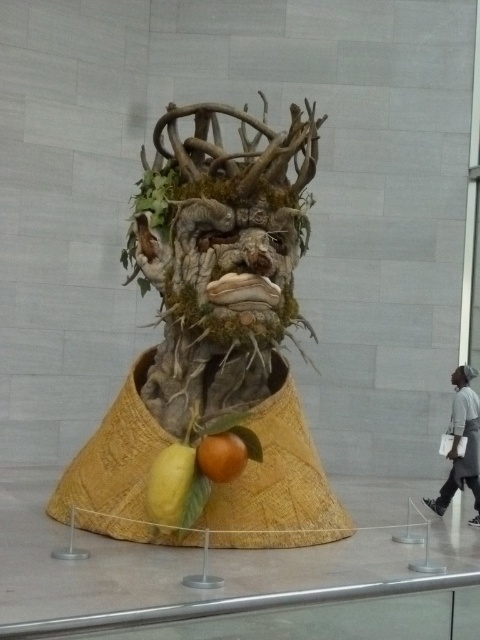
Question: Does mossy bark mask at center appear on the left side of gray fabric jacket at lower right?

Choices:
 (A) yes
 (B) no

Answer: (A)

Question: Is mossy bark mask at center bigger than orange matte at lower center?

Choices:
 (A) no
 (B) yes

Answer: (B)

Question: Which of these objects is positioned closest to the wooden sculpture at center?

Choices:
 (A) gray fabric jacket at lower right
 (B) matte brown mask at center
 (C) orange matte at lower center

Answer: (C)

Question: Which object is the farthest from the mossy bark mask at center?

Choices:
 (A) white matte face at center
 (B) yellow matte pear at lower center
 (C) orange matte at lower center
 (D) wooden sculpture at center

Answer: (A)

Question: Observing the image, what is the correct spatial positioning of wooden sculpture at center in reference to orange matte at lower center?

Choices:
 (A) left
 (B) right

Answer: (A)

Question: Estimate the real-world distances between objects in this image. Which object is farther from the orange matte at lower center?

Choices:
 (A) yellow matte pear at lower center
 (B) white matte face at center
 (C) mossy bark mask at center

Answer: (B)